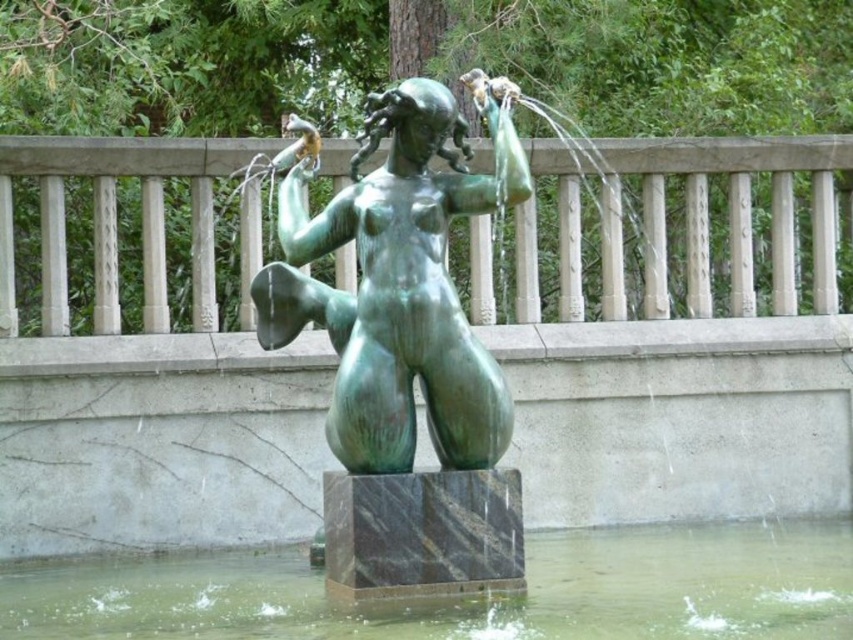
Question: Considering the relative positions of greenish water at base center and green patina statue at center in the image provided, where is greenish water at base center located with respect to green patina statue at center?

Choices:
 (A) above
 (B) below

Answer: (B)

Question: Can you confirm if greenish water at base center is positioned to the right of green patina statue at center?

Choices:
 (A) yes
 (B) no

Answer: (A)

Question: Is greenish water at base center positioned before green patina statue at center?

Choices:
 (A) no
 (B) yes

Answer: (B)

Question: Among these points, which one is farthest from the camera?

Choices:
 (A) (550, 586)
 (B) (341, 218)

Answer: (A)

Question: Which object appears closest to the camera in this image?

Choices:
 (A) greenish water at base center
 (B) green patina statue at center

Answer: (A)